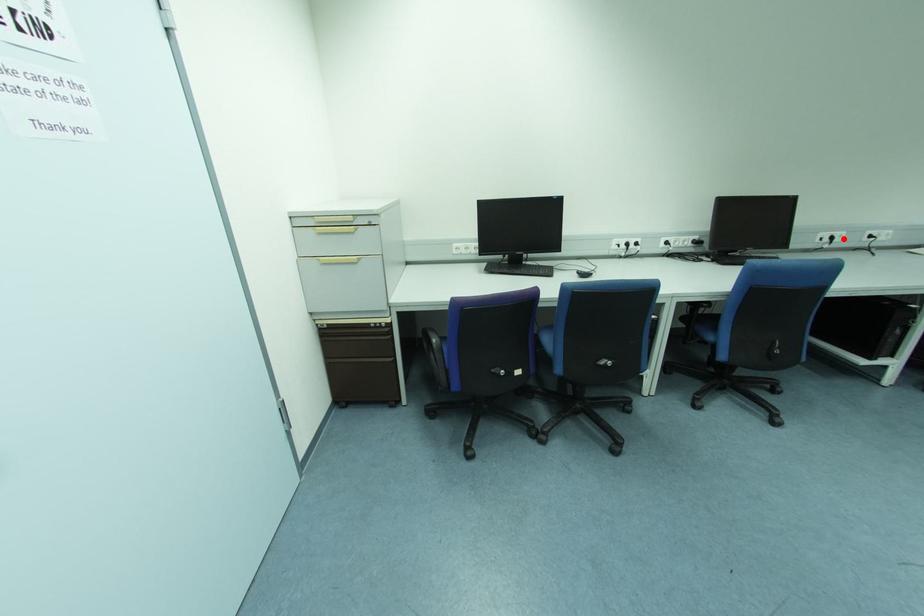
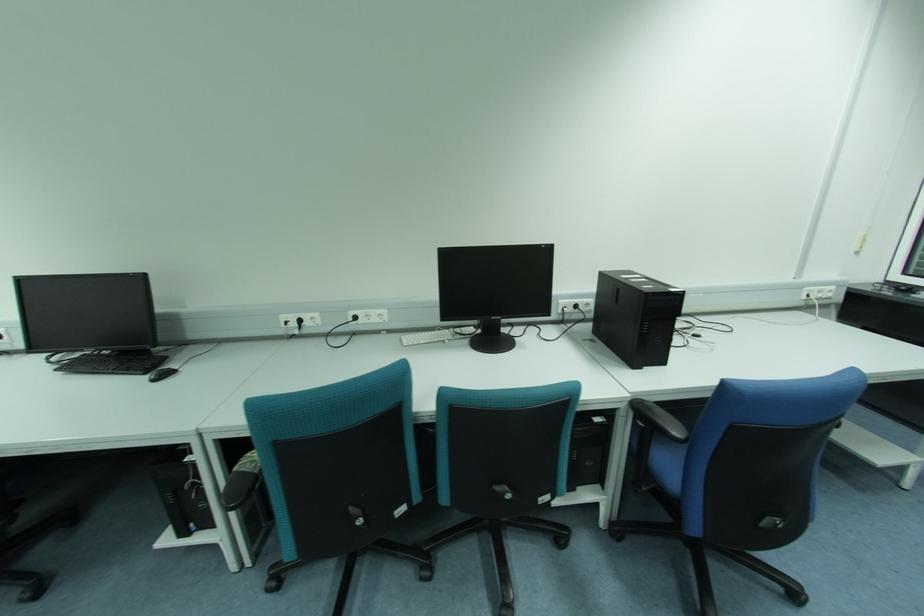
Locate, in the second image, the point that corresponds to the highlighted location in the first image.

(319, 322)